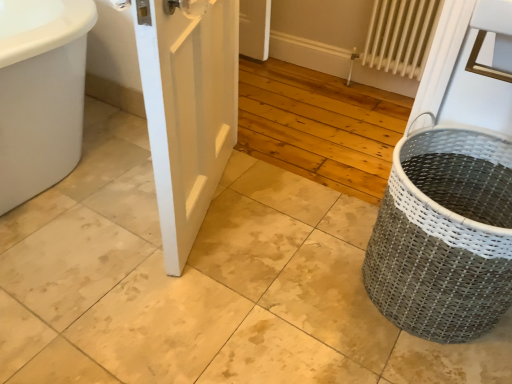
This screenshot has width=512, height=384. What are the coordinates of `white metal radiator at upper right` in the screenshot? It's located at (401, 35).

Measure the distance between gray woven basket at right and camera.

A distance of 38.37 inches exists between gray woven basket at right and camera.

I want to click on white metal radiator at upper right, so click(x=401, y=35).

Considering the relative positions of gray woven basket at right and white metal radiator at upper right in the image provided, is gray woven basket at right to the right of white metal radiator at upper right from the viewer's perspective?

In fact, gray woven basket at right is to the left of white metal radiator at upper right.

Can you tell me how much gray woven basket at right and white metal radiator at upper right differ in facing direction?

1.7 degrees separate the facing orientations of gray woven basket at right and white metal radiator at upper right.

From a real-world perspective, which is physically above, gray woven basket at right or white metal radiator at upper right?

From a 3D spatial view, white metal radiator at upper right is above.

Based on the photo, does gray woven basket at right have a greater width compared to white metal radiator at upper right?

Indeed, gray woven basket at right has a greater width compared to white metal radiator at upper right.

Is gray woven basket at right touching white matte door at center?

No, gray woven basket at right is not beside white matte door at center.

How different are the orientations of gray woven basket at right and white matte door at center in degrees?

112 degrees.

Is gray woven basket at right not inside white matte door at center?

Yes, gray woven basket at right is not within white matte door at center.

From the image's perspective, does gray woven basket at right appear higher than white matte door at center?

Incorrect, from the image's perspective, gray woven basket at right is lower than white matte door at center.

Which of these two, white metal radiator at upper right or white matte door at center, is wider?

With larger width is white matte door at center.

Does white metal radiator at upper right appear on the right side of white matte door at center?

Indeed, white metal radiator at upper right is positioned on the right side of white matte door at center.

Looking at this image, would you say white metal radiator at upper right is a long distance from white matte door at center?

white metal radiator at upper right is positioned a significant distance from white matte door at center.

What's the angular difference between white metal radiator at upper right and white matte door at center's facing directions?

The angle between the facing direction of white metal radiator at upper right and the facing direction of white matte door at center is 110 degrees.

Is white metal radiator at upper right oriented towards gray woven basket at right?

Yes.

Based on the photo, considering the relative sizes of white metal radiator at upper right and gray woven basket at right in the image provided, is white metal radiator at upper right smaller than gray woven basket at right?

Yes.

Is white metal radiator at upper right situated inside gray woven basket at right or outside?

white metal radiator at upper right is outside gray woven basket at right.

Considering the relative positions of white matte door at center and white metal radiator at upper right in the image provided, is white matte door at center behind white metal radiator at upper right?

No, it is in front of white metal radiator at upper right.

Is there a large distance between white matte door at center and white metal radiator at upper right?

Yes.

Which object is positioned more to the left, white matte door at center or white metal radiator at upper right?

white matte door at center.

From the image's perspective, relative to gray woven basket at right, is white matte door at center above or below?

Based on their image positions, white matte door at center is located above gray woven basket at right.

Would you say gray woven basket at right is part of white matte door at center's contents?

Actually, gray woven basket at right is outside white matte door at center.

Is the surface of white matte door at center in direct contact with gray woven basket at right?

No, white matte door at center is not touching gray woven basket at right.

Where is `basket container in front of the white metal radiator at upper right`? basket container in front of the white metal radiator at upper right is located at coordinates (444, 235).

The width and height of the screenshot is (512, 384). What are the coordinates of `door on the left of gray woven basket at right` in the screenshot? It's located at (188, 110).

When comparing their distances from white matte door at center, does white metal radiator at upper right or gray woven basket at right seem closer?

Among the two, gray woven basket at right is located nearer to white matte door at center.

From the image, which object appears to be nearer to gray woven basket at right, white matte door at center or white metal radiator at upper right?

white matte door at center is closer to gray woven basket at right.

Looking at the image, which one is located further to white matte door at center, gray woven basket at right or white metal radiator at upper right?

white metal radiator at upper right is positioned further to the anchor white matte door at center.

Consider the image. Which object lies further to the anchor point white metal radiator at upper right, gray woven basket at right or white matte door at center?

gray woven basket at right.

Looking at the image, which one is located closer to gray woven basket at right, white metal radiator at upper right or white matte door at center?

white matte door at center is closer to gray woven basket at right.

Based on their spatial positions, is white matte door at center or gray woven basket at right closer to white metal radiator at upper right?

The object closer to white metal radiator at upper right is white matte door at center.

Where is `basket container between white matte door at center and white metal radiator at upper right in the front-back direction`? This screenshot has width=512, height=384. basket container between white matte door at center and white metal radiator at upper right in the front-back direction is located at coordinates (444, 235).